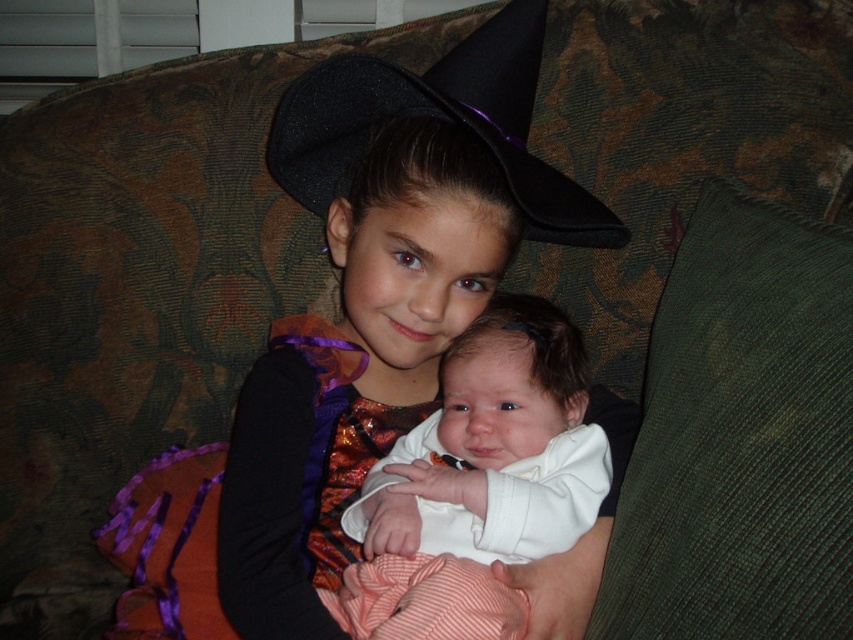
Question: Considering the relative positions of white soft baby at center and black felt witch hat at upper center in the image provided, where is white soft baby at center located with respect to black felt witch hat at upper center?

Choices:
 (A) left
 (B) right

Answer: (B)

Question: Which of the following is the farthest from the observer?

Choices:
 (A) black felt witch hat at upper center
 (B) white soft baby at center

Answer: (A)

Question: Which of the following is the farthest from the observer?

Choices:
 (A) (526, 129)
 (B) (479, 436)

Answer: (A)

Question: Does white soft baby at center appear on the right side of black felt witch hat at upper center?

Choices:
 (A) yes
 (B) no

Answer: (A)

Question: Where is white soft baby at center located in relation to black felt witch hat at upper center in the image?

Choices:
 (A) above
 (B) below

Answer: (B)